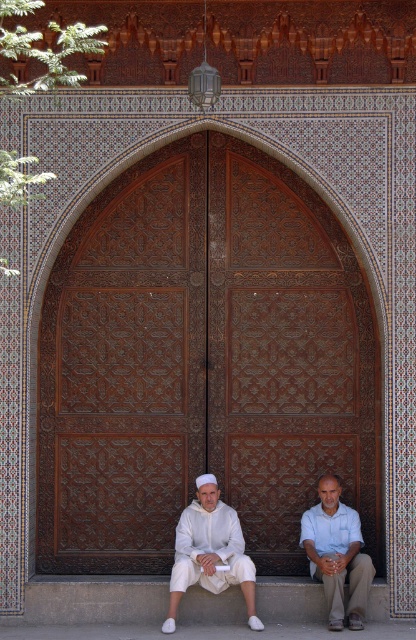
Is point (254, 465) more distant than point (329, 564)?

Yes, it is behind point (329, 564).

From the picture: Who is positioned more to the right, brown carved wood door at center or white cotton clothing at center?

From the viewer's perspective, white cotton clothing at center appears more on the right side.

Describe the element at coordinates (203, 364) in the screenshot. The image size is (416, 640). I see `brown carved wood door at center` at that location.

Where is `brown carved wood door at center`? The width and height of the screenshot is (416, 640). brown carved wood door at center is located at coordinates (203, 364).

Can you confirm if brown carved wood door at center is positioned above white cotton shirt at lower center?

Correct, brown carved wood door at center is located above white cotton shirt at lower center.

Who is more forward, (59, 317) or (299, 540)?

Point (299, 540) is in front.

Find the location of `brown carved wood door at center`. brown carved wood door at center is located at coordinates (203, 364).

Who is higher up, brown carved wood door at center or white matte clothing at lower center?

brown carved wood door at center is higher up.

Can you confirm if brown carved wood door at center is wider than white matte clothing at lower center?

Indeed, brown carved wood door at center has a greater width compared to white matte clothing at lower center.

Which is behind, point (343, 266) or point (217, 588)?

The point (343, 266) is more distant.

In order to click on brown carved wood door at center in this screenshot , I will do `click(203, 364)`.